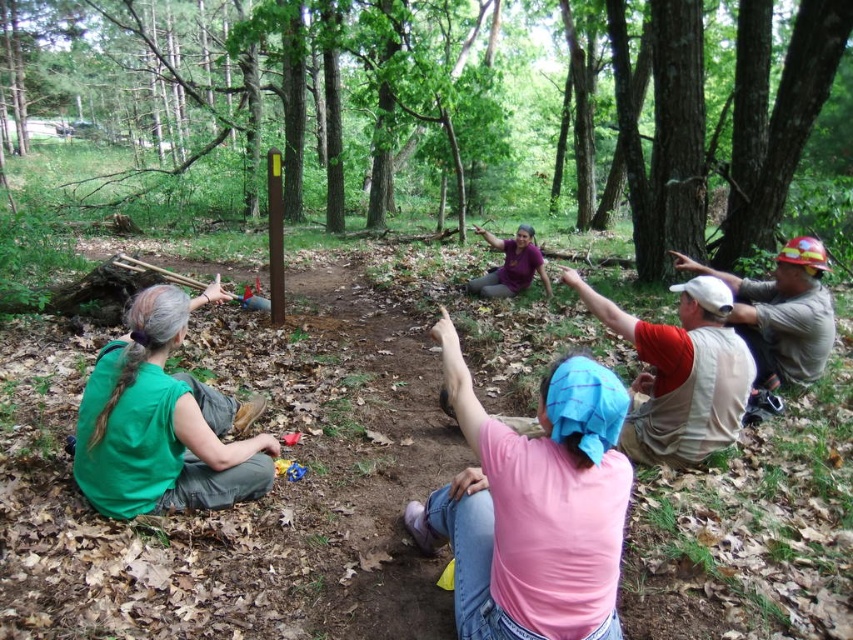
Question: Which object is the closest to the brown wood post at upper center?

Choices:
 (A) gray fabric shirt at right
 (B) purple matte shirt at center

Answer: (B)

Question: Which object is positioned closest to the gray fabric shirt at right?

Choices:
 (A) reddish-brown fabric shirt at center-right
 (B) purple matte shirt at center
 (C) brown wood post at upper center

Answer: (A)

Question: Is brown wood post at upper center bigger than reddish-brown fabric shirt at center-right?

Choices:
 (A) no
 (B) yes

Answer: (B)

Question: Estimate the real-world distances between objects in this image. Which object is farther from the gray fabric shirt at right?

Choices:
 (A) pink fabric headscarf at center
 (B) reddish-brown fabric shirt at center-right

Answer: (A)

Question: Is green fabric shirt at lower left in front of gray fabric shirt at right?

Choices:
 (A) no
 (B) yes

Answer: (B)

Question: Does brown wood post at upper center have a lesser width compared to gray fabric shirt at right?

Choices:
 (A) yes
 (B) no

Answer: (B)